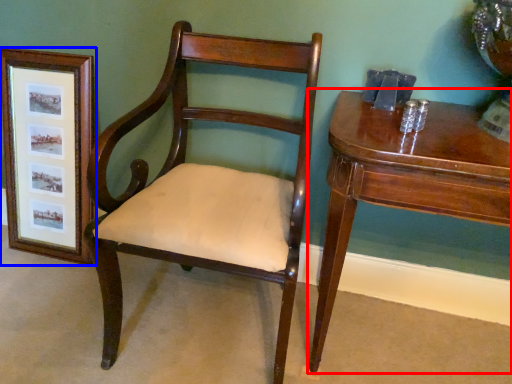
Question: Among these objects, which one is nearest to the camera, table (highlighted by a red box) or picture frame (highlighted by a blue box)?

Choices:
 (A) table
 (B) picture frame

Answer: (A)